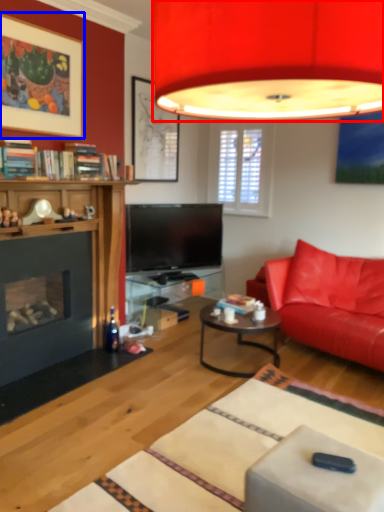
Question: Which object appears farthest to the camera in this image, lamp (highlighted by a red box) or picture frame (highlighted by a blue box)?

Choices:
 (A) lamp
 (B) picture frame

Answer: (B)